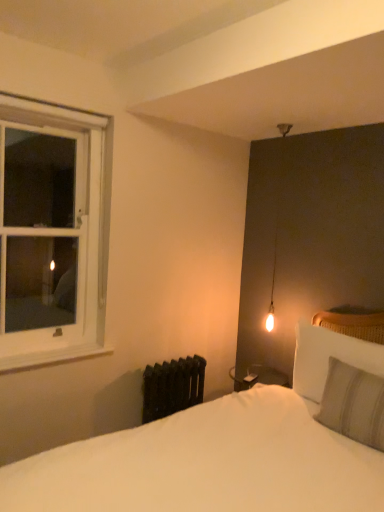
This screenshot has width=384, height=512. What do you see at coordinates (172, 387) in the screenshot?
I see `black cast iron radiator at lower left` at bounding box center [172, 387].

The width and height of the screenshot is (384, 512). Describe the element at coordinates (329, 357) in the screenshot. I see `gray striped pillow at right, the first pillow when ordered from back to front` at that location.

The image size is (384, 512). In order to click on light gray striped pillow at right, the first pillow viewed from the front in this screenshot , I will do `click(353, 404)`.

This screenshot has width=384, height=512. Describe the element at coordinates (52, 232) in the screenshot. I see `white wooden window at left` at that location.

This screenshot has height=512, width=384. I want to click on black cast iron radiator at lower left, so click(x=172, y=387).

Are light gray striped pillow at right, which is the 2th pillow in back-to-front order, and white wooden window at left beside each other?

No.

Where is `window located above the light gray striped pillow at right, the first pillow viewed from the front (from a real-world perspective)`? The width and height of the screenshot is (384, 512). window located above the light gray striped pillow at right, the first pillow viewed from the front (from a real-world perspective) is located at coordinates (52, 232).

Which object is thinner, light gray striped pillow at right, which is the 2th pillow in back-to-front order, or white wooden window at left?

white wooden window at left is thinner.

Is gray striped pillow at right, the first pillow when ordered from back to front, far from white painted wood at left?

Yes, gray striped pillow at right, the first pillow when ordered from back to front, and white painted wood at left are quite far apart.

You are a GUI agent. You are given a task and a screenshot of the screen. Output one action in this format:
    pyautogui.click(x=<x>, y=<y>)
    Task: Click on the window sill above the gray striped pillow at right, the first pillow when ordered from back to front (from the image's perspective)
    The height and width of the screenshot is (512, 384).
    Given the screenshot: What is the action you would take?
    pyautogui.click(x=52, y=356)

How far apart are gray striped pillow at right, the first pillow when ordered from back to front, and white painted wood at left?

gray striped pillow at right, the first pillow when ordered from back to front, and white painted wood at left are 1.18 meters apart from each other.

Which of these two, gray striped pillow at right, the 2th pillow from the front, or white painted wood at left, is wider?

With larger width is gray striped pillow at right, the 2th pillow from the front.

Is the depth of white soft bed at lower center greater than that of light gray striped pillow at right, which is the 2th pillow in back-to-front order?

No, the depth of white soft bed at lower center is less than that of light gray striped pillow at right, which is the 2th pillow in back-to-front order.

Is white soft bed at lower center completely or partially outside of light gray striped pillow at right, which is the 2th pillow in back-to-front order?

Yes, white soft bed at lower center is not within light gray striped pillow at right, which is the 2th pillow in back-to-front order.

Does white soft bed at lower center have a lesser width compared to light gray striped pillow at right, which is the 2th pillow in back-to-front order?

Incorrect, the width of white soft bed at lower center is not less than that of light gray striped pillow at right, which is the 2th pillow in back-to-front order.

This screenshot has width=384, height=512. What are the coordinates of `the 2nd pillow to the right of the white soft bed at lower center, starting your count from the anchor` in the screenshot? It's located at (353, 404).

From the image's perspective, which is below, black cast iron radiator at lower left or white painted wood at left?

From the image's view, black cast iron radiator at lower left is below.

Which is less distant, (x=157, y=408) or (x=112, y=350)?

Point (x=157, y=408).

Which object is positioned more to the right, black cast iron radiator at lower left or white painted wood at left?

black cast iron radiator at lower left is more to the right.

From a real-world perspective, which object rests below the other?

black cast iron radiator at lower left is physically lower.

From the picture: In the image, is white painted wood at left positioned in front of or behind gray striped pillow at right, the 2th pillow from the front?

Visually, white painted wood at left is located behind gray striped pillow at right, the 2th pillow from the front.

Looking at this image, is white painted wood at left thinner than gray striped pillow at right, the 2th pillow from the front?

Correct, the width of white painted wood at left is less than that of gray striped pillow at right, the 2th pillow from the front.

Could you tell me if white wooden window at left is facing light gray striped pillow at right, the first pillow viewed from the front?

No, white wooden window at left is not turned towards light gray striped pillow at right, the first pillow viewed from the front.

From the picture: From a real-world perspective, does white wooden window at left stand above light gray striped pillow at right, the first pillow viewed from the front?

Yes.

How different are the orientations of white wooden window at left and light gray striped pillow at right, which is the 2th pillow in back-to-front order, in degrees?

83.6 degrees separate the facing orientations of white wooden window at left and light gray striped pillow at right, which is the 2th pillow in back-to-front order.

Between white wooden window at left and light gray striped pillow at right, which is the 2th pillow in back-to-front order, which one appears on the right side from the viewer's perspective?

light gray striped pillow at right, which is the 2th pillow in back-to-front order, is more to the right.

Which object is closer to the camera, light gray striped pillow at right, the first pillow viewed from the front, or gray striped pillow at right, the first pillow when ordered from back to front?

light gray striped pillow at right, the first pillow viewed from the front.

Who is taller, light gray striped pillow at right, the first pillow viewed from the front, or gray striped pillow at right, the 2th pillow from the front?

With more height is light gray striped pillow at right, the first pillow viewed from the front.

Which object is positioned more to the right, light gray striped pillow at right, which is the 2th pillow in back-to-front order, or gray striped pillow at right, the first pillow when ordered from back to front?

light gray striped pillow at right, which is the 2th pillow in back-to-front order.

Considering the sizes of objects light gray striped pillow at right, which is the 2th pillow in back-to-front order, and gray striped pillow at right, the first pillow when ordered from back to front, in the image provided, who is bigger, light gray striped pillow at right, which is the 2th pillow in back-to-front order, or gray striped pillow at right, the first pillow when ordered from back to front,?

light gray striped pillow at right, which is the 2th pillow in back-to-front order.

This screenshot has width=384, height=512. What are the coordinates of `the 2nd pillow positioned below the white wooden window at left (from a real-world perspective)` in the screenshot? It's located at (353, 404).

Which pillow is the 1st one when counting from the front of the white painted wood at left? Please provide its 2D coordinates.

[(329, 357)]

From the image, which object appears to be nearer to black cast iron radiator at lower left, light gray striped pillow at right, which is the 2th pillow in back-to-front order, or white painted wood at left?

The object closer to black cast iron radiator at lower left is white painted wood at left.

Estimate the real-world distances between objects in this image. Which object is further from white wooden window at left, white soft bed at lower center or white painted wood at left?

Among the two, white soft bed at lower center is located further to white wooden window at left.

Estimate the real-world distances between objects in this image. Which object is closer to white wooden window at left, light gray striped pillow at right, which is the 2th pillow in back-to-front order, or white painted wood at left?

white painted wood at left.

Which object lies further to the anchor point white wooden window at left, light gray striped pillow at right, which is the 2th pillow in back-to-front order, or gray striped pillow at right, the 2th pillow from the front?

Among the two, light gray striped pillow at right, which is the 2th pillow in back-to-front order, is located further to white wooden window at left.

From the image, which object appears to be farther from white soft bed at lower center, white painted wood at left or black cast iron radiator at lower left?

The object further to white soft bed at lower center is white painted wood at left.

Looking at the image, which one is located further to black cast iron radiator at lower left, light gray striped pillow at right, the first pillow viewed from the front, or white soft bed at lower center?

Based on the image, light gray striped pillow at right, the first pillow viewed from the front, appears to be further to black cast iron radiator at lower left.

Based on their spatial positions, is white wooden window at left or white painted wood at left closer to light gray striped pillow at right, which is the 2th pillow in back-to-front order?

white painted wood at left lies closer to light gray striped pillow at right, which is the 2th pillow in back-to-front order, than the other object.

Considering their positions, is white wooden window at left positioned closer to white painted wood at left than light gray striped pillow at right, the first pillow viewed from the front?

→ light gray striped pillow at right, the first pillow viewed from the front.

The image size is (384, 512). Identify the location of pillow located between white painted wood at left and light gray striped pillow at right, which is the 2th pillow in back-to-front order, in the left-right direction. (329, 357).

Find the location of a particular element. The image size is (384, 512). window sill between white wooden window at left and light gray striped pillow at right, the first pillow viewed from the front, in the horizontal direction is located at coordinates (52, 356).

You are a GUI agent. You are given a task and a screenshot of the screen. Output one action in this format:
    pyautogui.click(x=<x>, y=<y>)
    Task: Click on the pillow between white wooden window at left and light gray striped pillow at right, which is the 2th pillow in back-to-front order
    The height and width of the screenshot is (512, 384).
    Given the screenshot: What is the action you would take?
    pos(329,357)

Locate an element on the screen. The image size is (384, 512). radiator located between white wooden window at left and light gray striped pillow at right, which is the 2th pillow in back-to-front order, in the left-right direction is located at coordinates tap(172, 387).